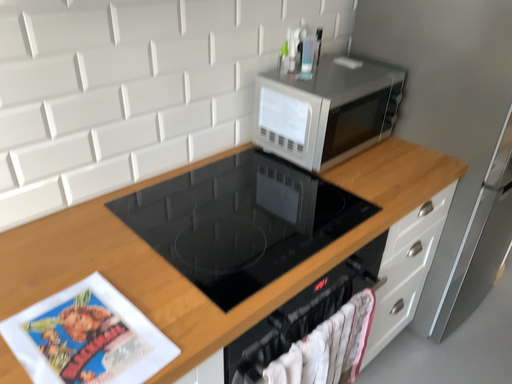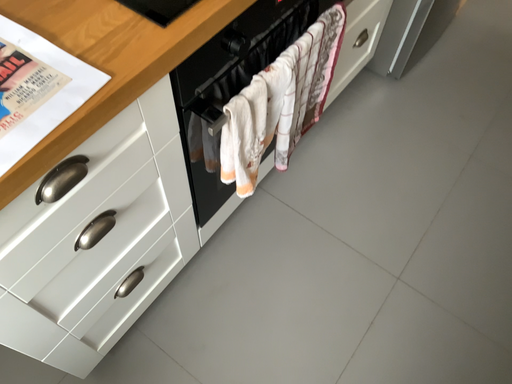
Question: How did the camera likely rotate when shooting the video?

Choices:
 (A) rotated downward
 (B) rotated upward

Answer: (A)